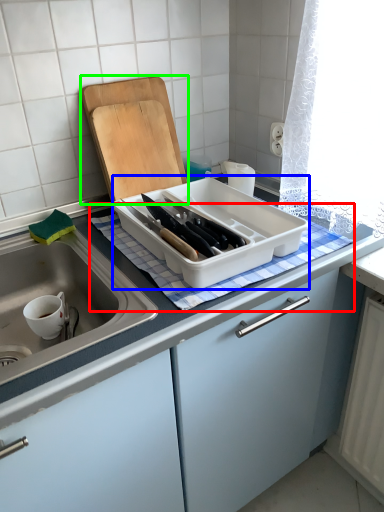
Question: Based on their relative distances, which object is farther from tablecloth (highlighted by a red box)? Choose from kitchen appliance (highlighted by a blue box) and cutting board (highlighted by a green box).

Choices:
 (A) kitchen appliance
 (B) cutting board

Answer: (B)